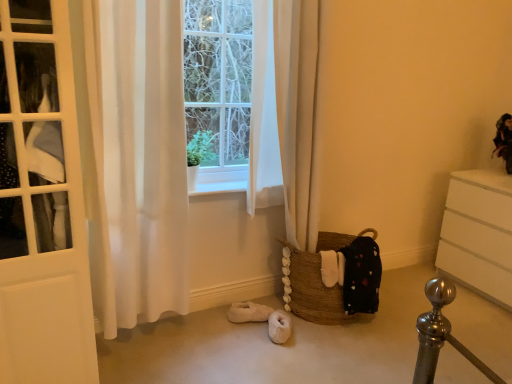
You are a GUI agent. You are given a task and a screenshot of the screen. Output one action in this format:
    pyautogui.click(x=<x>, y=<y>)
    Task: Click on the white matte chest of drawers at right
    The image size is (512, 384).
    Given the screenshot: What is the action you would take?
    pyautogui.click(x=479, y=234)

I want to click on velvet-like doll at upper right, so click(504, 140).

At what (x,y) coordinates should I click in order to perform the action: click on white matte chest of drawers at right. Please return your answer as a coordinate pair (x, y). This screenshot has width=512, height=384. Looking at the image, I should click on (479, 234).

From a real-world perspective, which object rests below the other?

brown woven basket at lower center, from a real-world perspective.

Which is less distant, [324,311] or [129,192]?

The point [129,192] is closer to the camera.

Is white sheer curtain at left at the back of brown woven basket at lower center?

brown woven basket at lower center is not turned away from white sheer curtain at left.

Which of these two, brown woven basket at lower center or white sheer curtain at left, is thinner?

With smaller width is white sheer curtain at left.

Considering the sizes of objects white matte chest of drawers at right and velvet-like doll at upper right in the image provided, who is shorter, white matte chest of drawers at right or velvet-like doll at upper right?

With less height is velvet-like doll at upper right.

Considering the positions of objects white matte chest of drawers at right and velvet-like doll at upper right in the image provided, who is more to the left, white matte chest of drawers at right or velvet-like doll at upper right?

white matte chest of drawers at right.

From the image's perspective, is white matte chest of drawers at right located above or below velvet-like doll at upper right?

Clearly, from the image's perspective, white matte chest of drawers at right is below velvet-like doll at upper right.

How much distance is there between white wood at center and brown woven basket at lower center?

A distance of 21.44 inches exists between white wood at center and brown woven basket at lower center.

Between point (271, 195) and point (307, 271), which one is positioned in front?

Positioned in front is point (307, 271).

Does white wood at center have a greater height compared to brown woven basket at lower center?

No, white wood at center is not taller than brown woven basket at lower center.

Can you confirm if white wood at center is wider than brown woven basket at lower center?

In fact, white wood at center might be narrower than brown woven basket at lower center.

Does white matte chest of drawers at right have a smaller size compared to brown woven basket at lower center?

No, white matte chest of drawers at right is not smaller than brown woven basket at lower center.

Find the location of `the chest of drawers that appears above the brown woven basket at lower center (from the image's perspective)`. the chest of drawers that appears above the brown woven basket at lower center (from the image's perspective) is located at coordinates (479, 234).

From their relative heights in the image, would you say white matte chest of drawers at right is taller or shorter than brown woven basket at lower center?

Clearly, white matte chest of drawers at right is taller compared to brown woven basket at lower center.

Is brown woven basket at lower center at the back of velvet-like doll at upper right?

velvet-like doll at upper right does not have its back to brown woven basket at lower center.

Considering the positions of point (497, 127) and point (327, 294), is point (497, 127) closer or farther from the camera than point (327, 294)?

Point (497, 127) is farther from the camera than point (327, 294).

Which object is closer to the camera, velvet-like doll at upper right or brown woven basket at lower center?

Positioned in front is brown woven basket at lower center.

How many degrees apart are the facing directions of velvet-like doll at upper right and brown woven basket at lower center?

velvet-like doll at upper right and brown woven basket at lower center are facing 92.9 degrees away from each other.

From a real-world perspective, which is physically below, velvet-like doll at upper right or white wood at center?

white wood at center is physically lower.

Considering the points (502, 136) and (274, 187), which point is in front, point (502, 136) or point (274, 187)?

The point (274, 187) is in front.

Considering the sizes of objects velvet-like doll at upper right and white wood at center in the image provided, who is smaller, velvet-like doll at upper right or white wood at center?

Smaller between the two is white wood at center.

Is velvet-like doll at upper right directly adjacent to white wood at center?

No.

From their relative heights in the image, would you say white wood at center is taller or shorter than white sheer curtain at left?

white wood at center is shorter than white sheer curtain at left.

Is point (277, 195) closer to viewer compared to point (114, 325)?

No, (277, 195) is behind (114, 325).

From a real-world perspective, is white wood at center positioned above or below white sheer curtain at left?

white wood at center is situated lower than white sheer curtain at left in the real world.

In the scene shown: Is the depth of white wood at center greater than that of white sheer curtain at left?

Yes, the depth of white wood at center is greater than that of white sheer curtain at left.

Identify the location of curtain above the brown woven basket at lower center (from the image's perspective). The height and width of the screenshot is (384, 512). (139, 163).

Where is `the chest of drawers that appears in front of the velvet-like doll at upper right`? The image size is (512, 384). the chest of drawers that appears in front of the velvet-like doll at upper right is located at coordinates (479, 234).

From the image, which object appears to be farther from white sheer curtain at left, white wood at center or white matte chest of drawers at right?

white matte chest of drawers at right lies further to white sheer curtain at left than the other object.

Estimate the real-world distances between objects in this image. Which object is closer to velvet-like doll at upper right, white sheer curtain at left or brown woven basket at lower center?

brown woven basket at lower center.

Based on the photo, based on their spatial positions, is white sheer curtain at left or white wood at center further from brown woven basket at lower center?

Based on the image, white sheer curtain at left appears to be further to brown woven basket at lower center.

Considering their positions, is brown woven basket at lower center positioned further to white wood at center than white matte chest of drawers at right?

white matte chest of drawers at right is further to white wood at center.

Looking at the image, which one is located further to white matte chest of drawers at right, velvet-like doll at upper right or brown woven basket at lower center?

brown woven basket at lower center is further to white matte chest of drawers at right.

When comparing their distances from velvet-like doll at upper right, does white sheer curtain at left or white matte chest of drawers at right seem closer?

Among the two, white matte chest of drawers at right is located nearer to velvet-like doll at upper right.

When comparing their distances from white wood at center, does white sheer curtain at left or velvet-like doll at upper right seem further?

velvet-like doll at upper right.

Looking at the image, which one is located closer to white wood at center, velvet-like doll at upper right or brown woven basket at lower center?

Based on the image, brown woven basket at lower center appears to be nearer to white wood at center.

Locate an element on the screen. The width and height of the screenshot is (512, 384). basket between white wood at center and white matte chest of drawers at right is located at coordinates click(316, 283).

Where is `window sill situated between white sheer curtain at left and brown woven basket at lower center from left to right`? window sill situated between white sheer curtain at left and brown woven basket at lower center from left to right is located at coordinates (219, 188).

The image size is (512, 384). Find the location of `basket between white sheer curtain at left and white matte chest of drawers at right`. basket between white sheer curtain at left and white matte chest of drawers at right is located at coordinates coord(316,283).

I want to click on the chest of drawers situated between white wood at center and velvet-like doll at upper right from left to right, so click(x=479, y=234).